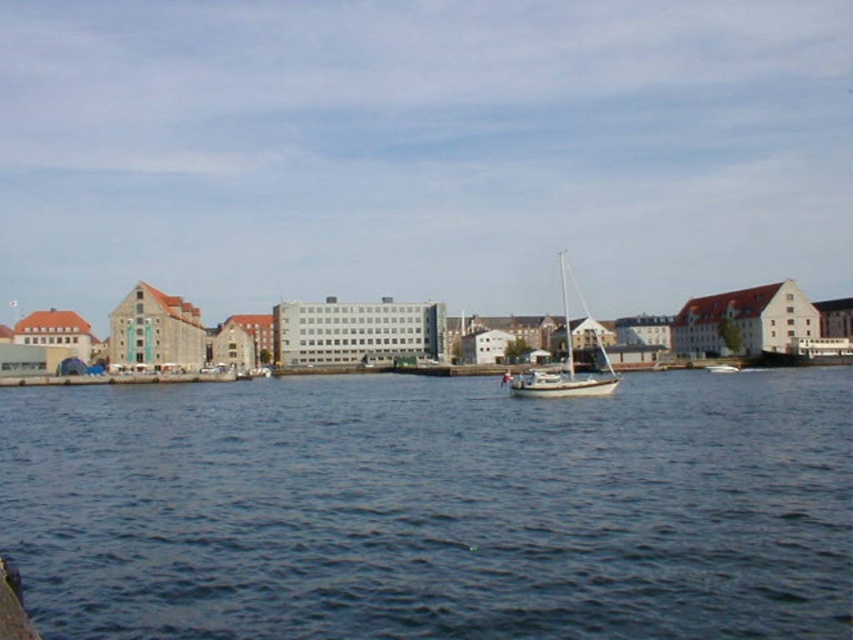
Question: Which of the following is the farthest from the observer?

Choices:
 (A) (260, 397)
 (B) (581, 380)

Answer: (A)

Question: In this image, where is blue water at center located relative to white matte sailboat at center?

Choices:
 (A) above
 (B) below

Answer: (B)

Question: In this image, where is blue water at center located relative to white matte sailboat at center?

Choices:
 (A) above
 (B) below

Answer: (B)

Question: Does blue water at center appear on the left side of white matte sailboat at center?

Choices:
 (A) yes
 (B) no

Answer: (A)

Question: Which point appears farthest from the camera in this image?

Choices:
 (A) (550, 388)
 (B) (701, 618)

Answer: (A)